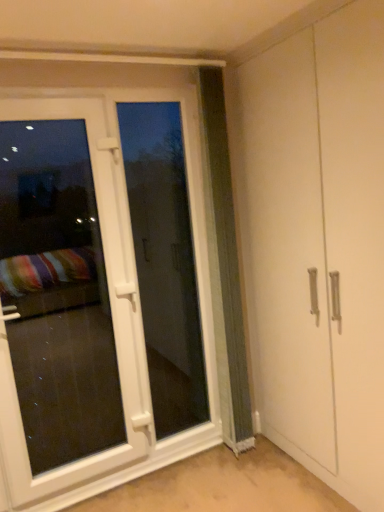
Image resolution: width=384 pixels, height=512 pixels. What do you see at coordinates (164, 262) in the screenshot?
I see `white plastic screen door at left` at bounding box center [164, 262].

The image size is (384, 512). I want to click on white plastic screen door at left, so click(164, 262).

Is white plastic screen door at left bigger than green textured curtain at center?

Actually, white plastic screen door at left might be smaller than green textured curtain at center.

Based on the photo, is white plastic screen door at left in front of or behind green textured curtain at center in the image?

white plastic screen door at left is behind green textured curtain at center.

Visually, is white plastic screen door at left positioned to the left or to the right of green textured curtain at center?

In the image, white plastic screen door at left appears on the left side of green textured curtain at center.

Between white glossy door at left and white plastic screen door at left, which one has larger width?

white glossy door at left is wider.

Is point (121, 443) positioned before point (161, 436)?

No, it is behind (161, 436).

Based on the photo, which object is positioned more to the left, white glossy door at left or white plastic screen door at left?

Positioned to the left is white glossy door at left.

How distant is white glossy door at left from white plastic screen door at left?

white glossy door at left and white plastic screen door at left are 29.49 centimeters apart.

Relative to green textured curtain at center, is white glossy door at left in front or behind?

white glossy door at left is positioned closer to the viewer than green textured curtain at center.

Which object is positioned more to the left, white glossy door at left or green textured curtain at center?

white glossy door at left.

Considering the points (32, 476) and (209, 154), which point is in front, point (32, 476) or point (209, 154)?

Positioned in front is point (32, 476).

Can you tell me how much white plastic screen door at left and white glossy door at left differ in facing direction?

The angular difference between white plastic screen door at left and white glossy door at left is 0.269 degrees.

From the image's perspective, would you say white plastic screen door at left is positioned over white glossy door at left?

Yes, from the image's perspective, white plastic screen door at left is on top of white glossy door at left.

Is point (160, 407) positioned before point (46, 356)?

Yes, it is.

Between white plastic screen door at left and white glossy door at left, which one appears on the left side from the viewer's perspective?

white glossy door at left is more to the left.

Consider the image. Is green textured curtain at center to the left or to the right of white glossy door at left in the image?

→ Clearly, green textured curtain at center is on the right of white glossy door at left in the image.

Would you say green textured curtain at center is inside or outside white glossy door at left?

green textured curtain at center is not enclosed by white glossy door at left.

Considering the relative sizes of green textured curtain at center and white glossy door at left in the image provided, is green textured curtain at center thinner than white glossy door at left?

In fact, green textured curtain at center might be wider than white glossy door at left.

Are green textured curtain at center and white glossy door at left making contact?

No, green textured curtain at center is not beside white glossy door at left.

Considering the sizes of objects green textured curtain at center and white plastic screen door at left in the image provided, who is wider, green textured curtain at center or white plastic screen door at left?

green textured curtain at center is wider.

Is white plastic screen door at left at the back of green textured curtain at center?

No.

Considering the positions of point (226, 148) and point (170, 136), is point (226, 148) closer or farther from the camera than point (170, 136)?

Point (226, 148) is positioned closer to the camera compared to point (170, 136).

In order to click on screen door on the left of green textured curtain at center in this screenshot , I will do `click(164, 262)`.

This screenshot has width=384, height=512. I want to click on screen door that is above the white glossy door at left (from a real-world perspective), so click(x=164, y=262).

Consider the image. Which object lies nearer to the anchor point white glossy door at left, green textured curtain at center or white plastic screen door at left?

white plastic screen door at left lies closer to white glossy door at left than the other object.

Considering their positions, is white plastic screen door at left positioned further to green textured curtain at center than white glossy door at left?

The object further to green textured curtain at center is white plastic screen door at left.

When comparing their distances from white plastic screen door at left, does green textured curtain at center or white glossy door at left seem further?

green textured curtain at center.

Looking at the image, which one is located further to green textured curtain at center, white glossy door at left or white plastic screen door at left?

Based on the image, white plastic screen door at left appears to be further to green textured curtain at center.

From the image, which object appears to be farther from white glossy door at left, white plastic screen door at left or green textured curtain at center?

The object further to white glossy door at left is green textured curtain at center.

Looking at this image, which object lies nearer to the anchor point white plastic screen door at left, white glossy door at left or green textured curtain at center?

white glossy door at left lies closer to white plastic screen door at left than the other object.

Where is `screen door between white glossy door at left and green textured curtain at center from left to right`? Image resolution: width=384 pixels, height=512 pixels. screen door between white glossy door at left and green textured curtain at center from left to right is located at coordinates (164, 262).